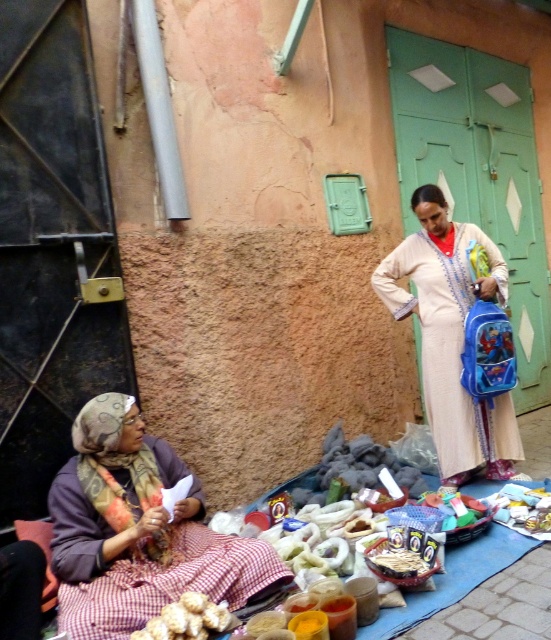
Consider the image. You are a photographer standing 5 feet away from the camera. You want to take a photo of the beige cotton dress at center. Can you reach the dress without moving the camera?

The beige cotton dress at center and camera are 10.00 feet apart from each other. Since you are already 5 feet away from the camera, the total distance between you and the dress is 15 feet. Therefore, you cannot reach the dress without moving the camera.

You are standing in the market scene described. You see a point marked at coordinates (x=138, y=531). What object is located at that point?

The point at coordinates (x=138, y=531) indicates the plaid fabric at lower left.